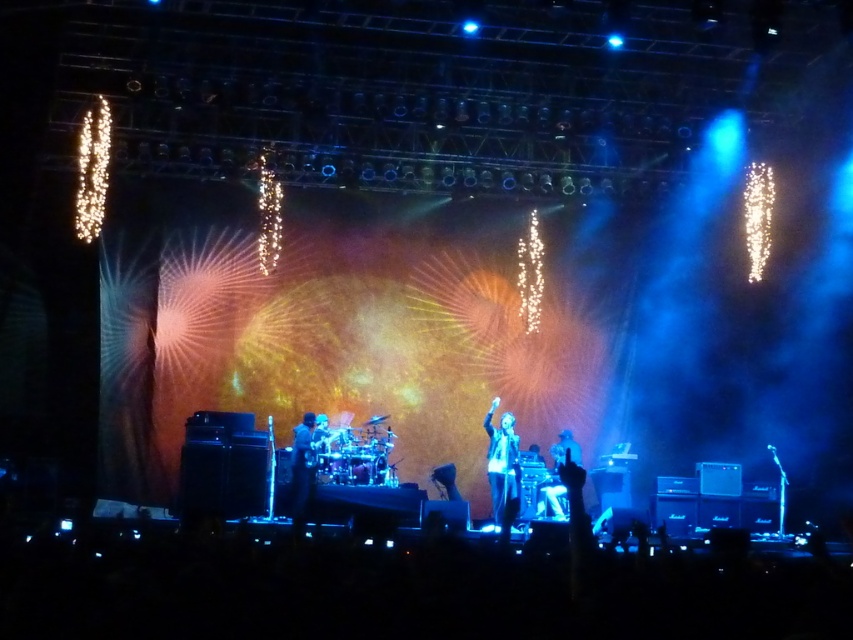
Question: Among these objects, which one is nearest to the camera?

Choices:
 (A) dark fabric jacket at center
 (B) shiny black jacket at center

Answer: (B)

Question: Which object is farther from the camera taking this photo?

Choices:
 (A) shiny black jacket at center
 (B) shiny silver microphone at center
 (C) dark fabric jacket at center

Answer: (B)

Question: Is dark fabric jacket at center positioned at the back of shiny silver microphone at center?

Choices:
 (A) yes
 (B) no

Answer: (B)

Question: Is shiny black jacket at center wider than shiny silver microphone at center?

Choices:
 (A) no
 (B) yes

Answer: (A)

Question: Is shiny black jacket at center above dark fabric jacket at center?

Choices:
 (A) yes
 (B) no

Answer: (B)

Question: Which object appears closest to the camera in this image?

Choices:
 (A) shiny silver microphone at center
 (B) shiny black jacket at center
 (C) dark fabric jacket at center

Answer: (B)